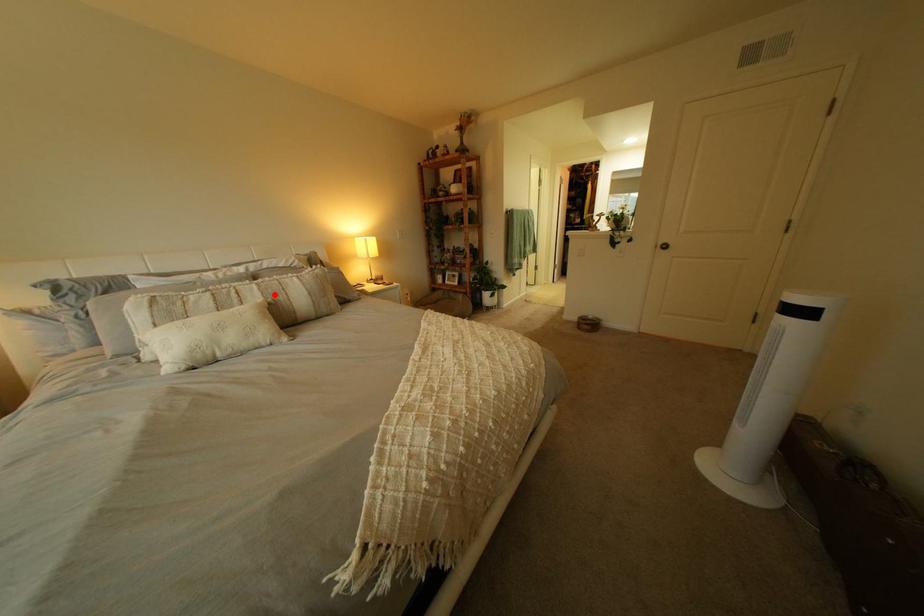
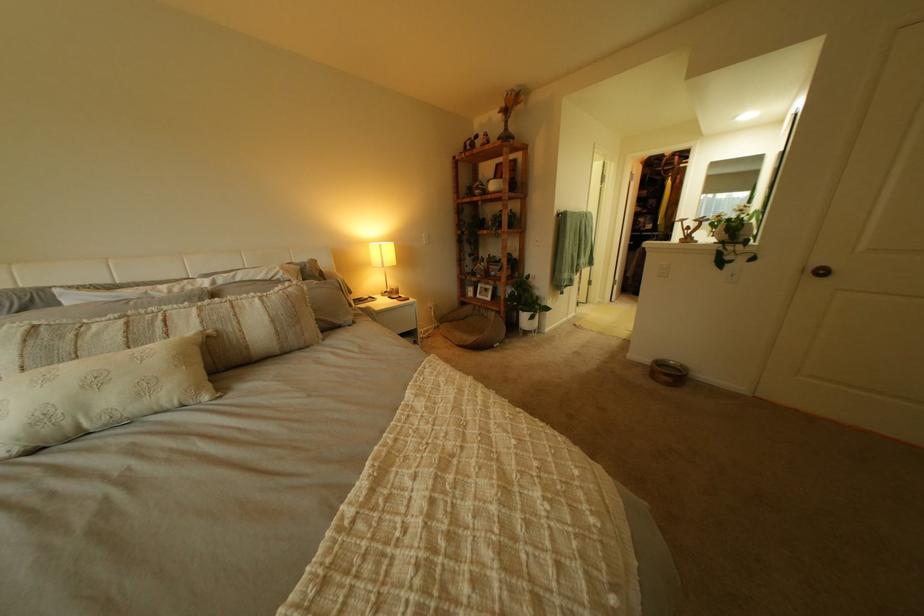
In the second image, find the point that corresponds to the highlighted location in the first image.

(213, 323)